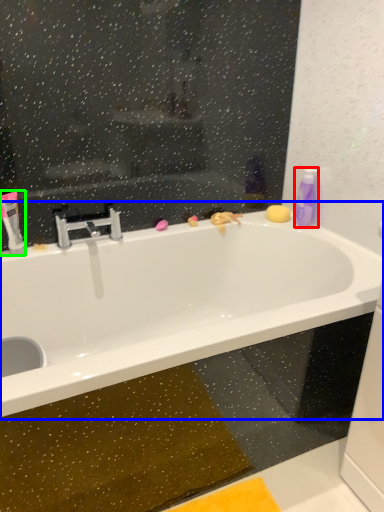
Question: Which is farther away from cleaning product (highlighted by a red box)? bathtub (highlighted by a blue box) or mouthwash (highlighted by a green box)?

Choices:
 (A) bathtub
 (B) mouthwash

Answer: (B)